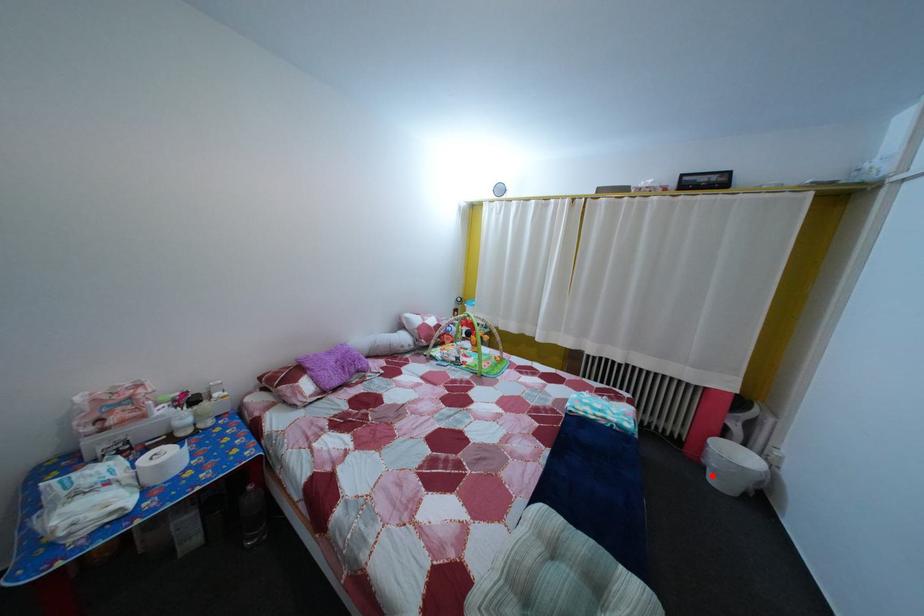
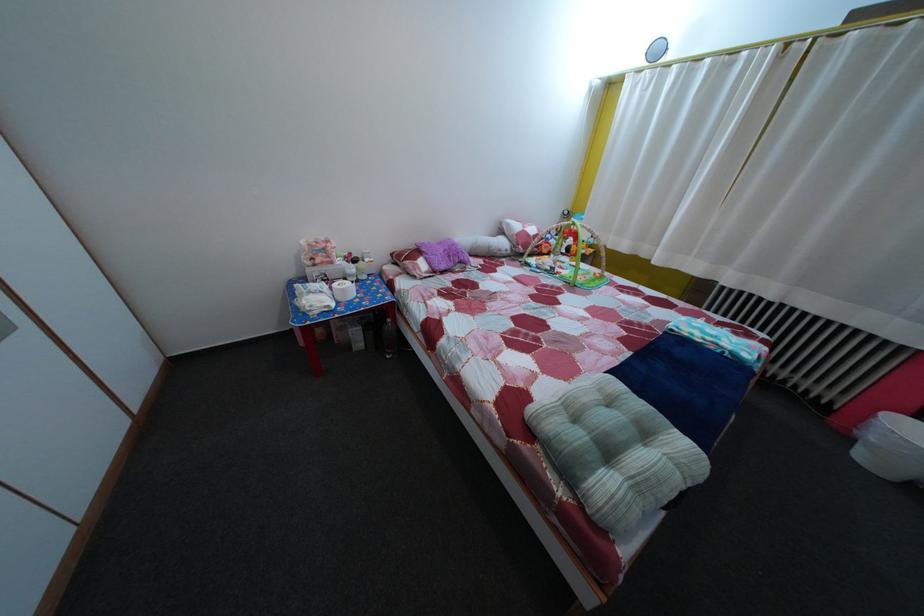
Question: A red point is marked in image1. In image2, is the corresponding 3D point closer to the camera or farther? Reply with the corresponding letter.

Choices:
 (A) The corresponding 3D point is closer.
 (B) The corresponding 3D point is farther.

Answer: (B)